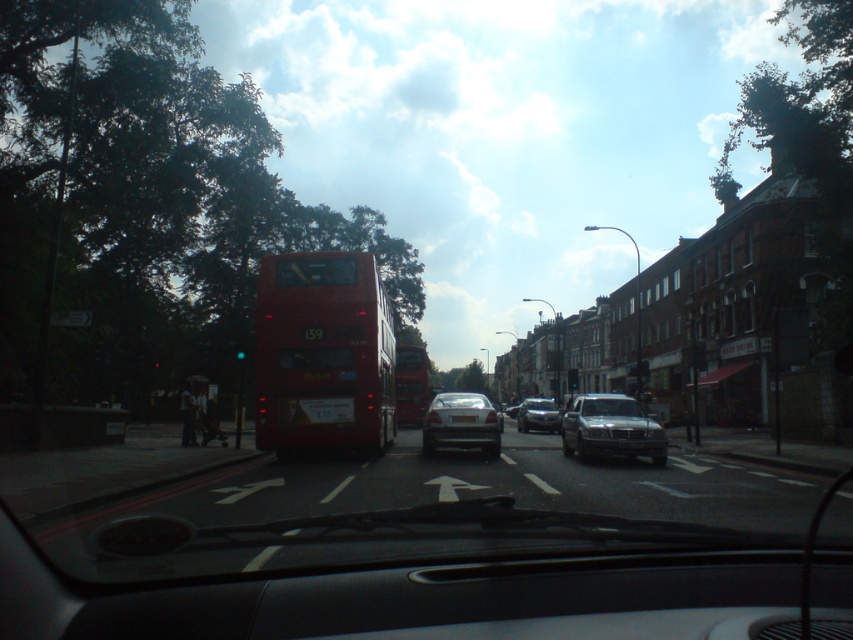
Question: Among these objects, which one is nearest to the camera?

Choices:
 (A) silver metallic sedan at center
 (B) black plastic license plate at center
 (C) satin silver sedan at center

Answer: (C)

Question: Which point is closer to the camera?

Choices:
 (A) shiny silver sedan at center
 (B) shiny red bus at center

Answer: (B)

Question: In this image, where is silver metallic sedan at center located relative to red matte bus at center?

Choices:
 (A) right
 (B) left

Answer: (A)

Question: Can you confirm if satin silver sedan at center is bigger than silver metallic sedan at center?

Choices:
 (A) no
 (B) yes

Answer: (B)

Question: Is silver metallic sedan at center positioned before red matte bus at center?

Choices:
 (A) yes
 (B) no

Answer: (A)

Question: Which is nearer to the silver metallic sedan at center?

Choices:
 (A) shiny red bus at center
 (B) white plastic license plate at center

Answer: (A)